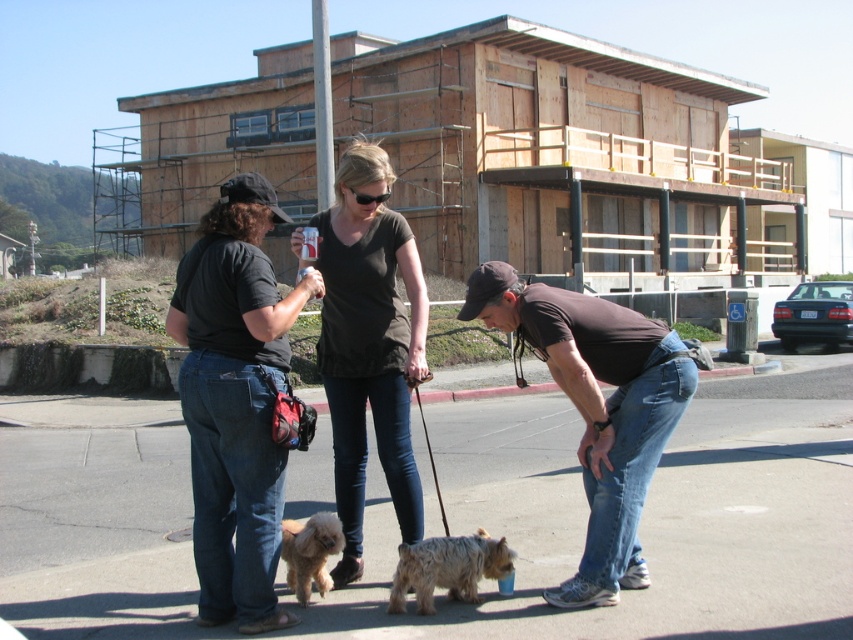
Is point (107, 634) positioned before point (314, 525)?

That is True.

Can you confirm if smooth asphalt pavement at center is positioned below fluffy golden dog at center?

Indeed, smooth asphalt pavement at center is positioned under fluffy golden dog at center.

Where is `smooth asphalt pavement at center`? The image size is (853, 640). smooth asphalt pavement at center is located at coordinates (643, 518).

You are a GUI agent. You are given a task and a screenshot of the screen. Output one action in this format:
    pyautogui.click(x=<x>, y=<y>)
    Task: Click on the smooth asphalt pavement at center
    
    Given the screenshot: What is the action you would take?
    pyautogui.click(x=643, y=518)

Is dark gray t-shirt at left to the left of black matte shirt at center from the viewer's perspective?

Yes, dark gray t-shirt at left is to the left of black matte shirt at center.

Is dark gray t-shirt at left smaller than black matte shirt at center?

Indeed, dark gray t-shirt at left has a smaller size compared to black matte shirt at center.

This screenshot has height=640, width=853. Identify the location of dark gray t-shirt at left. (235, 401).

Is point (425, 358) positioned before point (389, 605)?

No, it is not.

Which is behind, point (338, 516) or point (457, 550)?

Positioned behind is point (338, 516).

Between point (352, 168) and point (421, 570), which one is positioned behind?

Positioned behind is point (352, 168).

Find the location of `black matte shirt at center`. black matte shirt at center is located at coordinates (369, 342).